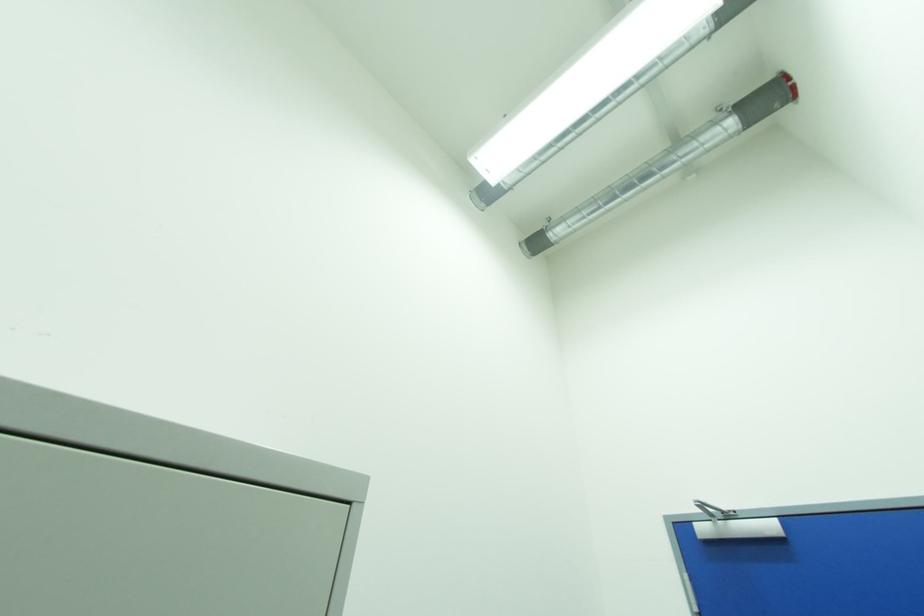
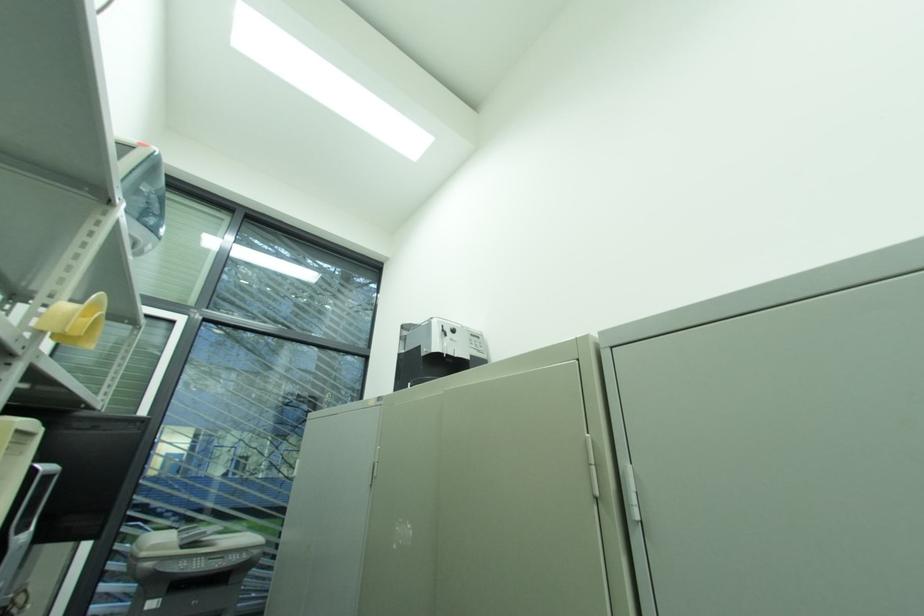
How did the camera likely rotate?

The camera rotated toward left-up.